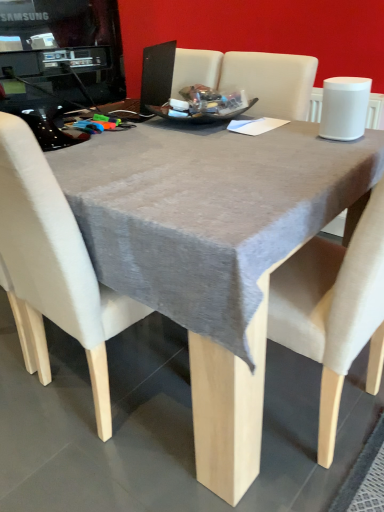
In order to click on beige fabric chair at center in this screenshot , I will do `click(53, 267)`.

The height and width of the screenshot is (512, 384). Find the location of `beige fabric chair at center`. beige fabric chair at center is located at coordinates (53, 267).

How different are the orientations of beige fabric chair at center and black glossy desktop computer at upper left in degrees?

76.2 degrees.

Which of these two, beige fabric chair at center or black glossy desktop computer at upper left, is bigger?

Bigger between the two is beige fabric chair at center.

Is point (52, 190) positioned behind point (106, 79)?

No, (52, 190) is closer to viewer.

From the image's perspective, relative to black glossy desktop computer at upper left, is beige fabric chair at center above or below?

From the image's perspective, beige fabric chair at center appears below black glossy desktop computer at upper left.

Is black glossy desktop computer at upper left at the right side of gray fabric table at center?

Incorrect, black glossy desktop computer at upper left is not on the right side of gray fabric table at center.

Image resolution: width=384 pixels, height=512 pixels. In order to click on table on the right of black glossy desktop computer at upper left in this screenshot , I will do `click(229, 408)`.

Can you tell me how much black glossy desktop computer at upper left and gray fabric table at center differ in facing direction?

There is a 166-degree angle between the facing directions of black glossy desktop computer at upper left and gray fabric table at center.

Considering the sizes of objects black glossy desktop computer at upper left and gray fabric table at center in the image provided, who is thinner, black glossy desktop computer at upper left or gray fabric table at center?

black glossy desktop computer at upper left.

Is black glossy desktop computer at upper left placed right next to beige fabric chair at center?

No, black glossy desktop computer at upper left is not in contact with beige fabric chair at center.

Can beige fabric chair at center be found inside black glossy desktop computer at upper left?

No.

Which object is thinner, black glossy desktop computer at upper left or beige fabric chair at center?

Thinner between the two is black glossy desktop computer at upper left.

Between beige fabric chair at center and gray fabric table at center, which one appears on the right side from the viewer's perspective?

Positioned to the right is gray fabric table at center.

Looking at this image, considering the sizes of beige fabric chair at center and gray fabric table at center in the image, is beige fabric chair at center taller or shorter than gray fabric table at center?

beige fabric chair at center is taller than gray fabric table at center.

Would you say beige fabric chair at center contains gray fabric table at center?

Actually, gray fabric table at center is outside beige fabric chair at center.

Based on their sizes in the image, would you say gray fabric table at center is bigger or smaller than beige fabric chair at center?

Considering their sizes, gray fabric table at center takes up more space than beige fabric chair at center.

In the scene shown: Is gray fabric table at center not close to beige fabric chair at center?

gray fabric table at center is actually quite close to beige fabric chair at center.

Who is taller, gray fabric table at center or beige fabric chair at center?

beige fabric chair at center is taller.

Is gray fabric table at center outside of black glossy desktop computer at upper left?

gray fabric table at center lies outside black glossy desktop computer at upper left's area.

From a real-world perspective, is gray fabric table at center positioned over black glossy desktop computer at upper left based on gravity?

No, from a real-world perspective, gray fabric table at center is not on top of black glossy desktop computer at upper left.

Are gray fabric table at center and black glossy desktop computer at upper left located far from each other?

Actually, gray fabric table at center and black glossy desktop computer at upper left are a little close together.

Which is in front, point (327, 377) or point (113, 76)?

Positioned in front is point (327, 377).

This screenshot has height=512, width=384. Identify the location of desktop computer above the beige fabric chair at center (from a real-world perspective). (69, 47).

You are a GUI agent. You are given a task and a screenshot of the screen. Output one action in this format:
    pyautogui.click(x=<x>, y=<y>)
    Task: Click on the desktop computer behind the gray fabric table at center
    The height and width of the screenshot is (512, 384).
    Given the screenshot: What is the action you would take?
    pyautogui.click(x=69, y=47)

When comparing their distances from beige fabric chair at center, does black glossy desktop computer at upper left or gray fabric table at center seem closer?

The object closer to beige fabric chair at center is gray fabric table at center.

From the image, which object appears to be nearer to black glossy desktop computer at upper left, beige fabric chair at center or gray fabric table at center?

Based on the image, beige fabric chair at center appears to be nearer to black glossy desktop computer at upper left.

From the image, which object appears to be farther from beige fabric chair at center, gray fabric table at center or black glossy desktop computer at upper left?

black glossy desktop computer at upper left is further to beige fabric chair at center.

From the image, which object appears to be farther from gray fabric table at center, black glossy desktop computer at upper left or beige fabric chair at center?

black glossy desktop computer at upper left lies further to gray fabric table at center than the other object.

Looking at the image, which one is located further to gray fabric table at center, beige fabric chair at center or black glossy desktop computer at upper left?

black glossy desktop computer at upper left is positioned further to the anchor gray fabric table at center.

Estimate the real-world distances between objects in this image. Which object is further from black glossy desktop computer at upper left, gray fabric table at center or beige fabric chair at center?

Based on the image, gray fabric table at center appears to be further to black glossy desktop computer at upper left.

Image resolution: width=384 pixels, height=512 pixels. In order to click on table between black glossy desktop computer at upper left and beige fabric chair at center in the up-down direction in this screenshot , I will do `click(229, 408)`.